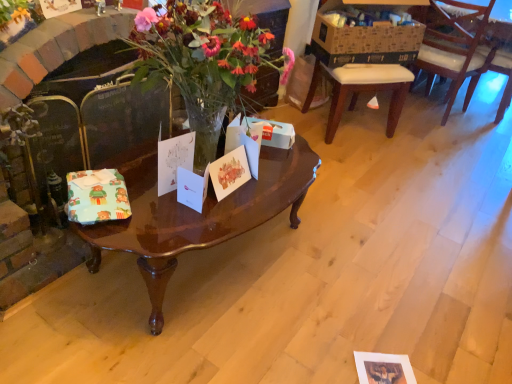
Where is `vacant space that's between wooden chair at right and glossy wood coffee table at center`? This screenshot has width=512, height=384. vacant space that's between wooden chair at right and glossy wood coffee table at center is located at coordinates (393, 164).